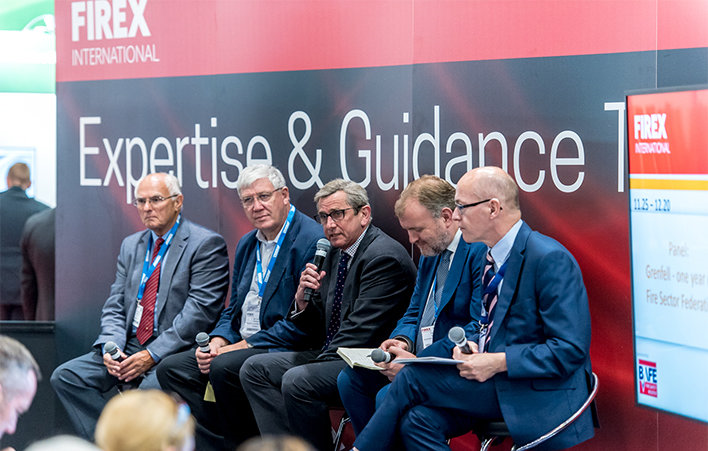
Where is `gray wall`? This screenshot has height=451, width=708. gray wall is located at coordinates (173, 98).